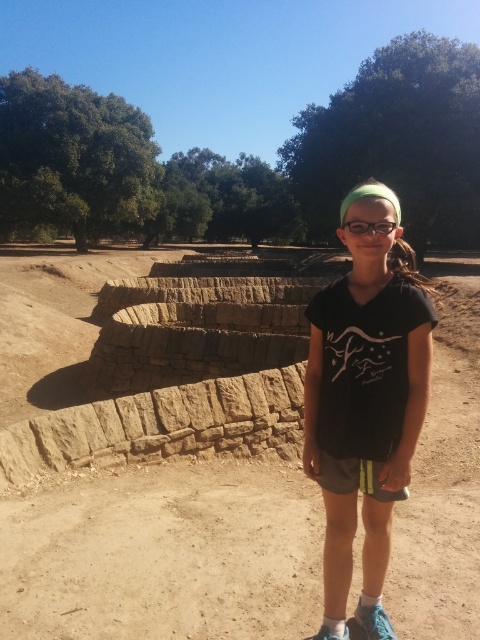
Question: Considering the relative positions of brown dirt field at center and black matte t-shirt at center in the image provided, where is brown dirt field at center located with respect to black matte t-shirt at center?

Choices:
 (A) above
 (B) below

Answer: (A)

Question: Does brown dirt field at center lie in front of black matte t-shirt at center?

Choices:
 (A) no
 (B) yes

Answer: (A)

Question: Which point appears farthest from the camera in this image?

Choices:
 (A) (382, 310)
 (B) (6, 396)

Answer: (B)

Question: Which point is farther to the camera?

Choices:
 (A) (385, 480)
 (B) (33, 516)

Answer: (B)

Question: Can you confirm if brown dirt field at center is smaller than black matte t-shirt at center?

Choices:
 (A) no
 (B) yes

Answer: (A)

Question: Which point is farther to the camera?

Choices:
 (A) (186, 490)
 (B) (394, 211)

Answer: (A)